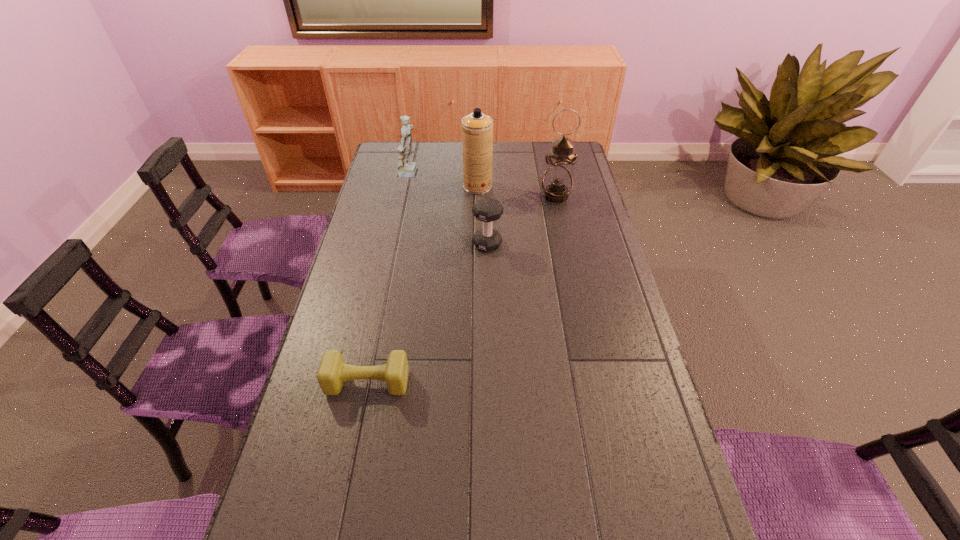
Locate an element on the screen. The height and width of the screenshot is (540, 960). object that is the fourth closest one to the oil lamp is located at coordinates (333, 371).

Locate an element on the screen. The image size is (960, 540). vacant region that satisfies the following two spatial constraints: 1. on the front-facing side of the figurine; 2. on the left side of the aerosol can is located at coordinates (408, 186).

Where is `vacant region that satisfies the following two spatial constraints: 1. on the back side of the aerosol can; 2. on the left side of the nearer dumbbell`? This screenshot has height=540, width=960. vacant region that satisfies the following two spatial constraints: 1. on the back side of the aerosol can; 2. on the left side of the nearer dumbbell is located at coordinates (408, 186).

Locate an element on the screen. The height and width of the screenshot is (540, 960). vacant point that satisfies the following two spatial constraints: 1. on the front-facing side of the third tallest object; 2. on the left side of the left dumbbell is located at coordinates (368, 382).

Locate an element on the screen. Image resolution: width=960 pixels, height=540 pixels. free space that satisfies the following two spatial constraints: 1. on the front-facing side of the third tallest object; 2. on the left side of the rightmost object is located at coordinates (406, 196).

Identify the location of vacant space that satisfies the following two spatial constraints: 1. on the back side of the fourth tallest object; 2. on the front-facing side of the third tallest object. The width and height of the screenshot is (960, 540). (486, 175).

At what (x,y) coordinates should I click in order to perform the action: click on free space that satisfies the following two spatial constraints: 1. on the front-facing side of the third tallest object; 2. on the left side of the shortest object. Please return your answer as a coordinate pair (x, y). Looking at the image, I should click on (368, 382).